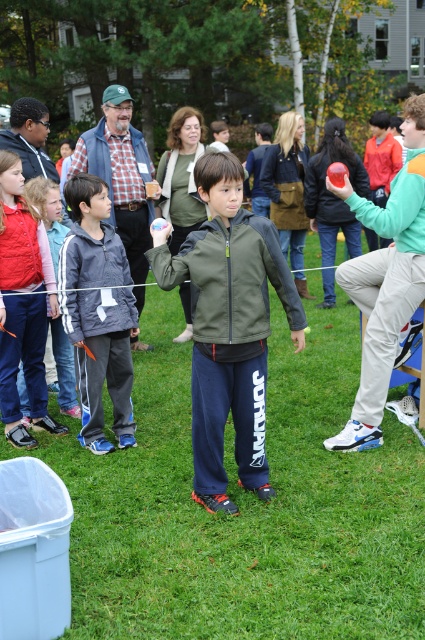
Does matte plastic ball at center lie in front of gray fleece jacket at center?

That is True.

Is point (79, 579) positioned before point (82, 419)?

Yes, point (79, 579) is in front of point (82, 419).

Where is `matte plastic ball at center`? This screenshot has height=640, width=425. matte plastic ball at center is located at coordinates (329, 422).

Where is `matte plastic ball at center`? matte plastic ball at center is located at coordinates (x=329, y=422).

Is point (243, 586) less distant than point (124, 403)?

Yes, it is.

Is green grass at center smaller than gray fleece jacket at center?

Incorrect, green grass at center is not smaller in size than gray fleece jacket at center.

Between point (373, 608) and point (73, 230), which one is positioned behind?

The point (73, 230) is behind.

The image size is (425, 640). In order to click on green grass at center in this screenshot , I will do `click(246, 506)`.

Does green grass at center have a greater height compared to matte plastic ball at center?

Incorrect, green grass at center's height is not larger of matte plastic ball at center's.

Is green grass at center in front of matte plastic ball at center?

Yes, green grass at center is closer to the viewer.

You are a GUI agent. You are given a task and a screenshot of the screen. Output one action in this format:
    pyautogui.click(x=<x>, y=<y>)
    Task: Click on the green grass at center
    The image size is (425, 640).
    Given the screenshot: What is the action you would take?
    pyautogui.click(x=246, y=506)